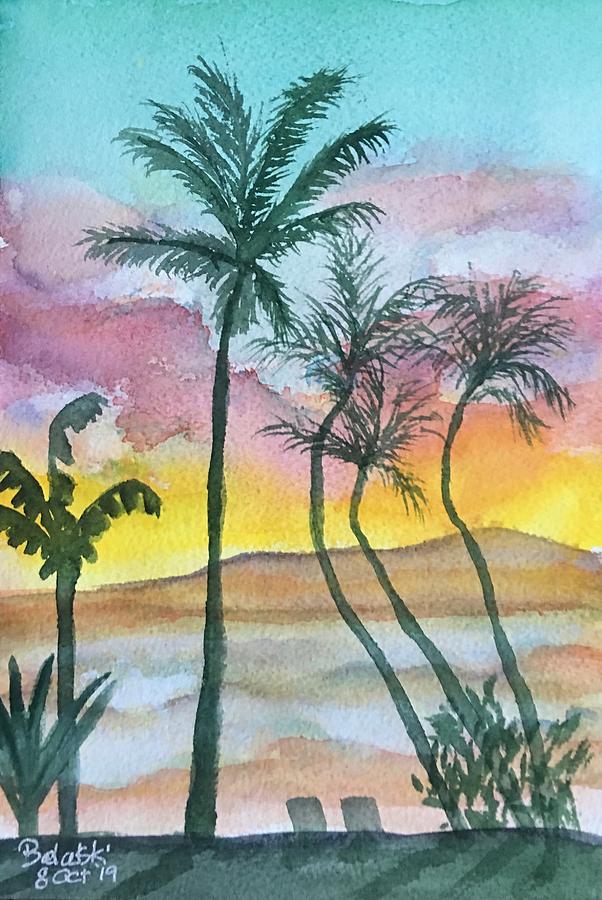
Identify the location of very left plant. (29, 760).